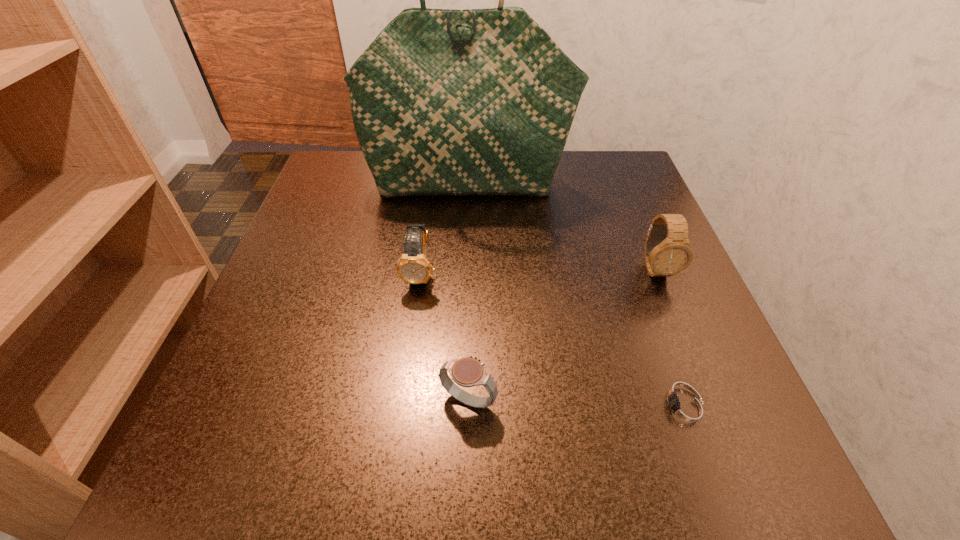
At what (x,y) coordinates should I click in order to perform the action: click on the third closest watch to the farthest object. Please return your answer as a coordinate pair (x, y). The width and height of the screenshot is (960, 540). Looking at the image, I should click on (684, 409).

Locate an element on the screen. The width and height of the screenshot is (960, 540). vacant space that satisfies the following two spatial constraints: 1. on the face of the second tallest watch; 2. on the right side of the third tallest watch is located at coordinates (403, 401).